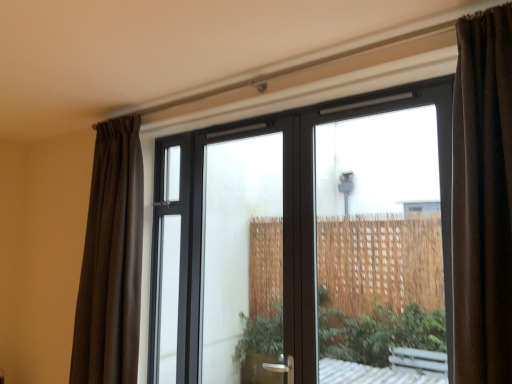
Question: Is transparent glass window at center not close to transparent glass door at center?

Choices:
 (A) yes
 (B) no

Answer: (A)

Question: Is transparent glass door at center surrounded by transparent glass window at center?

Choices:
 (A) yes
 (B) no

Answer: (A)

Question: From the image's perspective, is transparent glass window at center under transparent glass door at center?

Choices:
 (A) yes
 (B) no

Answer: (B)

Question: Does transparent glass window at center have a greater width compared to transparent glass door at center?

Choices:
 (A) yes
 (B) no

Answer: (A)

Question: Is transparent glass window at center turned away from transparent glass door at center?

Choices:
 (A) yes
 (B) no

Answer: (A)

Question: Is transparent glass window at center smaller than transparent glass door at center?

Choices:
 (A) no
 (B) yes

Answer: (A)

Question: Does brown sheer curtain at left come behind transparent glass window at center?

Choices:
 (A) no
 (B) yes

Answer: (B)

Question: Is brown sheer curtain at left positioned far away from transparent glass window at center?

Choices:
 (A) no
 (B) yes

Answer: (B)

Question: Considering the relative sizes of brown sheer curtain at left and transparent glass window at center in the image provided, is brown sheer curtain at left bigger than transparent glass window at center?

Choices:
 (A) yes
 (B) no

Answer: (B)

Question: From a real-world perspective, is brown sheer curtain at left positioned under transparent glass window at center based on gravity?

Choices:
 (A) no
 (B) yes

Answer: (A)

Question: Can you confirm if brown sheer curtain at left is shorter than transparent glass window at center?

Choices:
 (A) yes
 (B) no

Answer: (A)

Question: Is brown sheer curtain at left looking in the opposite direction of transparent glass window at center?

Choices:
 (A) no
 (B) yes

Answer: (B)

Question: Would you say transparent glass door at center is outside brown sheer curtain at left?

Choices:
 (A) no
 (B) yes

Answer: (B)